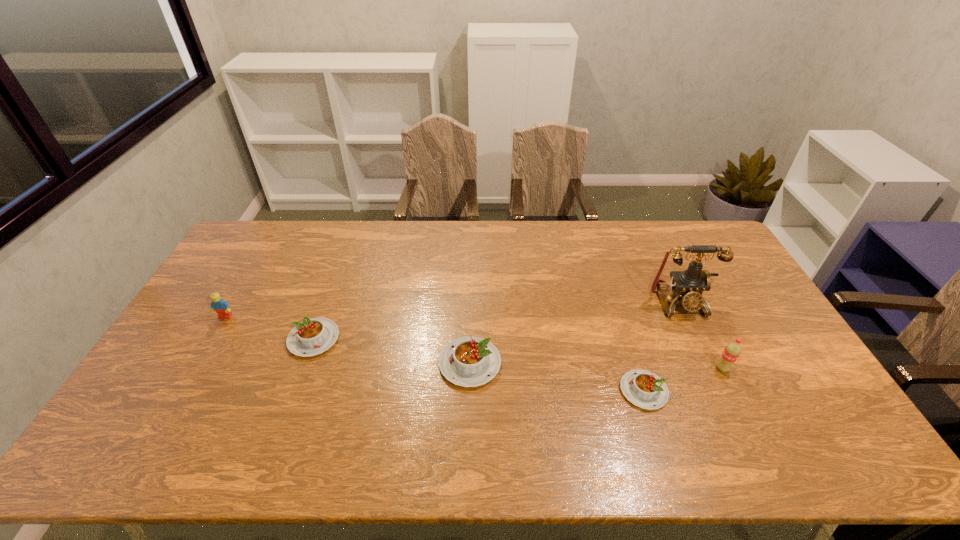
You are a GUI agent. You are given a task and a screenshot of the screen. Output one action in this format:
    pyautogui.click(x=<x>, y=<y>)
    Task: Click on the free point at the right edge
    The image size is (960, 540).
    Given the screenshot: What is the action you would take?
    pyautogui.click(x=727, y=310)

The width and height of the screenshot is (960, 540). In the image, there is a desktop. Find the location of `free space at the far left corner`. free space at the far left corner is located at coordinates (279, 248).

At what (x,y) coordinates should I click in order to perform the action: click on free space at the far right corner of the desktop. Please return your answer as a coordinate pair (x, y). This screenshot has width=960, height=540. Looking at the image, I should click on (708, 244).

In order to click on free spot at the near right corner of the desktop in this screenshot , I will do `click(816, 397)`.

Where is `vacant space in between the second pudding from right to left and the telephone`? The height and width of the screenshot is (540, 960). vacant space in between the second pudding from right to left and the telephone is located at coordinates (574, 333).

This screenshot has height=540, width=960. I want to click on vacant area between the tallest object and the third object from right to left, so click(x=660, y=347).

The image size is (960, 540). In order to click on free space between the fourth object from right to left and the leftmost object in this screenshot , I will do `click(348, 340)`.

Locate an element on the screen. This screenshot has width=960, height=540. free point between the fourth shortest object and the rightmost pudding is located at coordinates (435, 354).

Image resolution: width=960 pixels, height=540 pixels. In order to click on vacant space in between the soda and the second pudding from left to right in this screenshot , I will do `click(596, 366)`.

This screenshot has height=540, width=960. I want to click on free point between the fourth object from right to left and the fifth tallest object, so click(x=392, y=351).